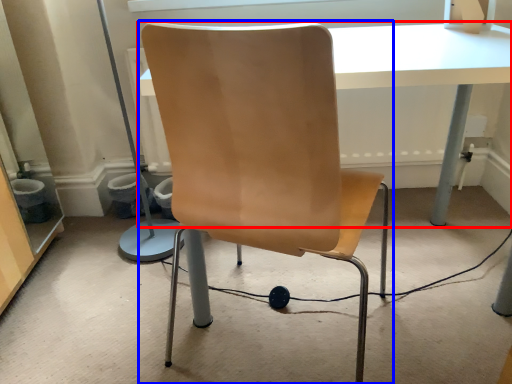
Question: Among these objects, which one is farthest to the camera, table (highlighted by a red box) or chair (highlighted by a blue box)?

Choices:
 (A) table
 (B) chair

Answer: (A)